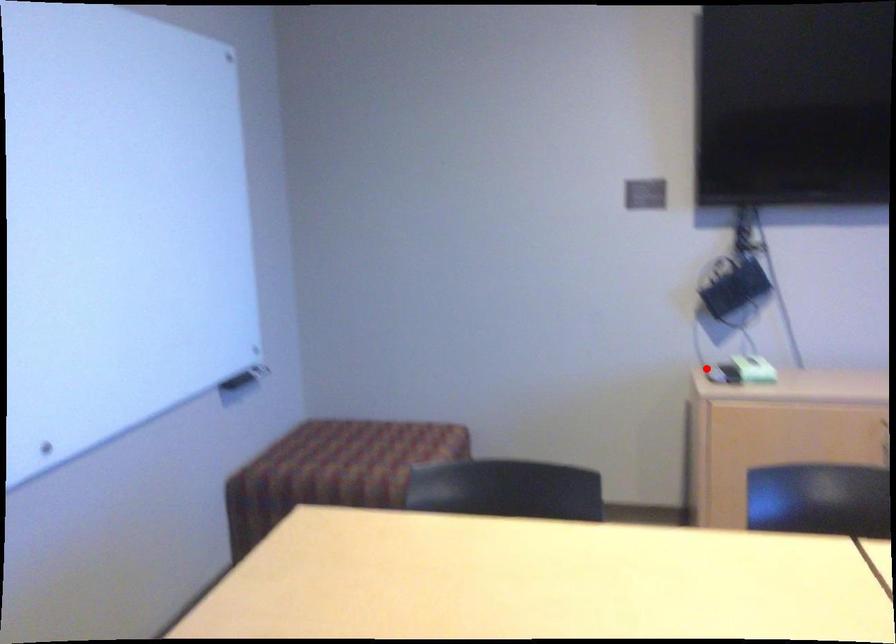
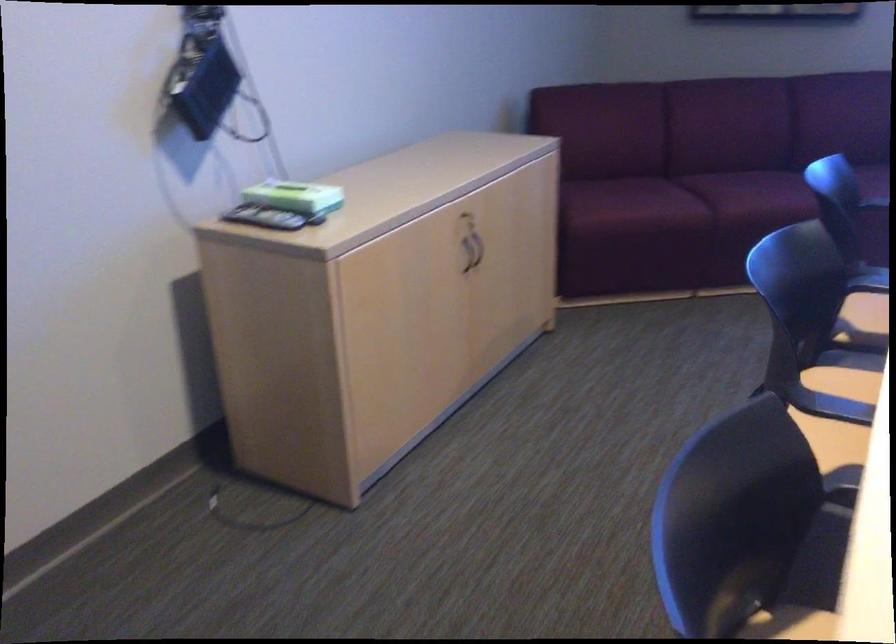
In the second image, find the point that corresponds to the highlighted location in the first image.

(263, 218)